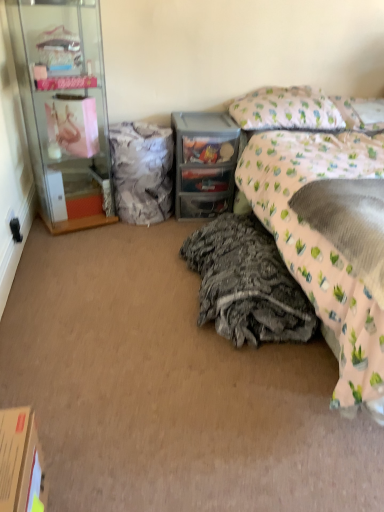
At what (x,y) coordinates should I click in order to perform the action: click on free location in front of textured gray blanket at lower center, which is counted as the 1th material, starting from the bottom. Please return your answer as a coordinate pair (x, y). The height and width of the screenshot is (512, 384). Looking at the image, I should click on (221, 396).